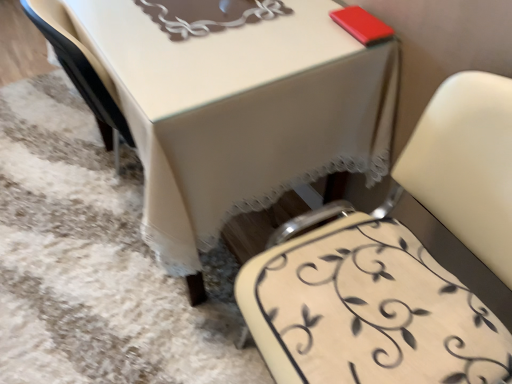
Question: From a real-world perspective, is creamy leather chair at lower right physically located above or below white leather chair at center?

Choices:
 (A) below
 (B) above

Answer: (B)

Question: Do you think creamy leather chair at lower right is within white leather chair at center, or outside of it?

Choices:
 (A) inside
 (B) outside

Answer: (A)

Question: Which of these objects is positioned closest to the white leather chair at center?

Choices:
 (A) white lace tablecloth at center
 (B) creamy leather chair at lower right

Answer: (B)

Question: Which is nearer to the creamy leather chair at lower right?

Choices:
 (A) white leather chair at center
 (B) white lace tablecloth at center

Answer: (A)